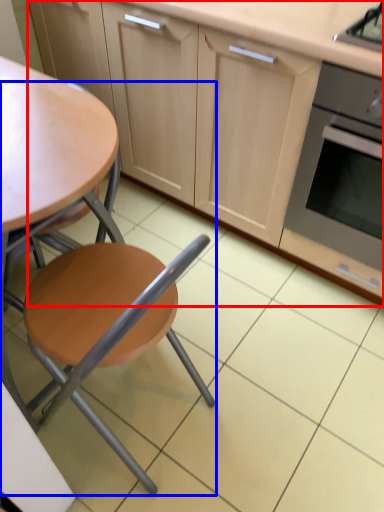
Question: Which object appears closest to the camera in this image, cabinetry (highlighted by a red box) or chair (highlighted by a blue box)?

Choices:
 (A) cabinetry
 (B) chair

Answer: (B)